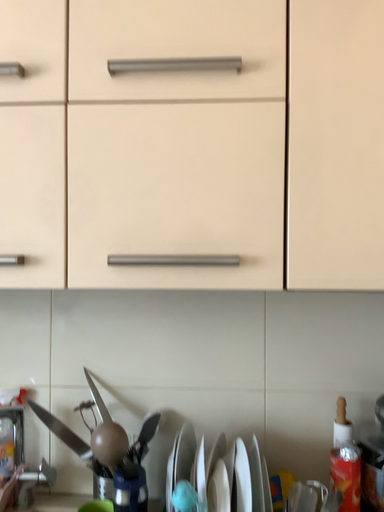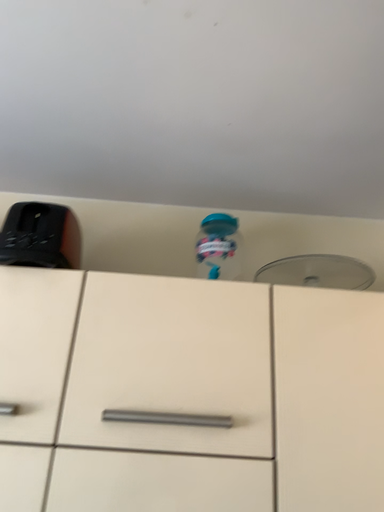
Question: How did the camera likely rotate when shooting the video?

Choices:
 (A) rotated upward
 (B) rotated downward

Answer: (A)